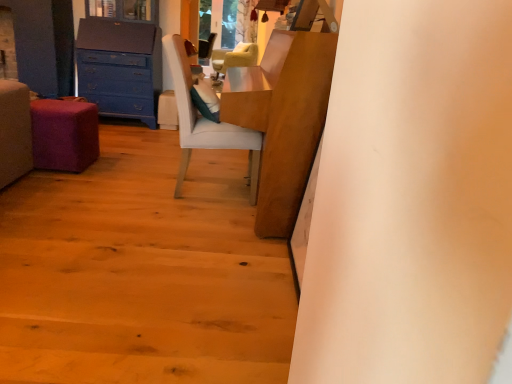
At what (x,y) coordinates should I click in order to perform the action: click on free point below white fabric chair at center, arranged as the 2th chair when viewed from the back (from a real-world perspective). Please return your answer as a coordinate pair (x, y). The image size is (512, 384). Looking at the image, I should click on (200, 183).